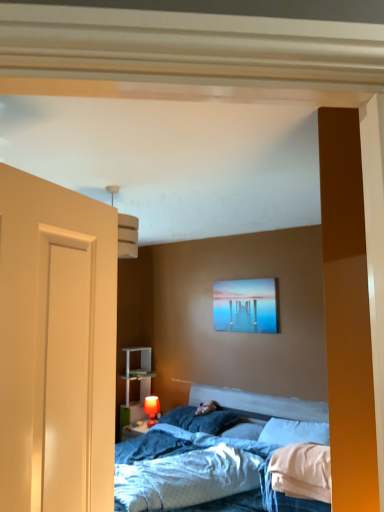
What is the approximate width of white soft pillow at center, which is counted as the 3th pillow, starting from the left?

The width of white soft pillow at center, which is counted as the 3th pillow, starting from the left, is 14.53 inches.

How much space does white soft pillow at center, which is counted as the second pillow, starting from the left, occupy vertically?

4.08 inches.

The height and width of the screenshot is (512, 384). Identify the location of blue soft pillow at center, the 1th pillow from the left. (200, 420).

What do you see at coordinates (245, 305) in the screenshot? This screenshot has height=512, width=384. I see `matte acrylic painting at upper center` at bounding box center [245, 305].

What do you see at coordinates (151, 409) in the screenshot? Image resolution: width=384 pixels, height=512 pixels. I see `matte red table lamp at lower center` at bounding box center [151, 409].

Where is `blue textured sheet at center`? blue textured sheet at center is located at coordinates (179, 446).

Is blue textured sheet at center next to white soft pillow at center, the 2th pillow from the right?

No, blue textured sheet at center is not touching white soft pillow at center, the 2th pillow from the right.

At what (x,y) coordinates should I click in order to perform the action: click on the 2nd pillow located beneath the blue textured sheet at center (from a real-world perspective). Please return your answer as a coordinate pair (x, y). Looking at the image, I should click on (244, 431).

Can you tell me how much blue textured sheet at center and white soft pillow at center, which is counted as the second pillow, starting from the left, differ in facing direction?

The angle between the facing direction of blue textured sheet at center and the facing direction of white soft pillow at center, which is counted as the second pillow, starting from the left, is 29.6 degrees.

In order to click on pillow that is the 1st one when counting forward from the white plastic shelf at lower left in this screenshot , I will do `click(200, 420)`.

Is point (226, 422) farther from camera compared to point (127, 414)?

No, (226, 422) is closer to viewer.

From the image's perspective, who appears lower, blue soft pillow at center, the 1th pillow from the left, or white plastic shelf at lower left?

white plastic shelf at lower left, from the image's perspective.

Considering the positions of objects blue soft pillow at center, which is counted as the third pillow, starting from the right, and white plastic shelf at lower left in the image provided, who is more to the right, blue soft pillow at center, which is counted as the third pillow, starting from the right, or white plastic shelf at lower left?

blue soft pillow at center, which is counted as the third pillow, starting from the right.

From a real-world perspective, which object stands above the other?

white soft pillow at center, the 1th pillow from the right, is physically above.

Looking at this image, from the image's perspective, who appears lower, matte red table lamp at lower center or white soft pillow at center, which is counted as the 3th pillow, starting from the left?

matte red table lamp at lower center appears lower in the image.

In the scene shown: Considering the relative sizes of matte red table lamp at lower center and white soft pillow at center, the 1th pillow from the right, in the image provided, is matte red table lamp at lower center thinner than white soft pillow at center, the 1th pillow from the right,?

Yes, matte red table lamp at lower center is thinner than white soft pillow at center, the 1th pillow from the right.

Is matte red table lamp at lower center not inside white soft pillow at center, which is counted as the 3th pillow, starting from the left?

Absolutely, matte red table lamp at lower center is external to white soft pillow at center, which is counted as the 3th pillow, starting from the left.

From the image's perspective, which one is positioned lower, white soft pillow at center, the 2th pillow from the right, or white plastic shelf at lower left?

white plastic shelf at lower left.

Considering the relative positions of white soft pillow at center, the 2th pillow from the right, and white plastic shelf at lower left in the image provided, is white soft pillow at center, the 2th pillow from the right, behind white plastic shelf at lower left?

No.

Which is correct: white soft pillow at center, which is counted as the second pillow, starting from the left, is inside white plastic shelf at lower left, or outside of it?

white soft pillow at center, which is counted as the second pillow, starting from the left, exists outside the volume of white plastic shelf at lower left.

Which object is positioned more to the left, white soft pillow at center, the 2th pillow from the right, or white plastic shelf at lower left?

Positioned to the left is white plastic shelf at lower left.

Is the depth of matte red table lamp at lower center greater than that of matte acrylic painting at upper center?

Yes, it is behind matte acrylic painting at upper center.

Is matte red table lamp at lower center wider or thinner than matte acrylic painting at upper center?

In the image, matte red table lamp at lower center appears to be wider than matte acrylic painting at upper center.

Does matte red table lamp at lower center have a larger size compared to matte acrylic painting at upper center?

Incorrect, matte red table lamp at lower center is not larger than matte acrylic painting at upper center.

Are matte red table lamp at lower center and white plastic shelf at lower left far apart?

No, matte red table lamp at lower center is not far from white plastic shelf at lower left.

Where is `dresser lying behind the matte red table lamp at lower center`? dresser lying behind the matte red table lamp at lower center is located at coordinates (140, 386).

What's the angular difference between matte red table lamp at lower center and white plastic shelf at lower left's facing directions?

The angular difference between matte red table lamp at lower center and white plastic shelf at lower left is 0.822 degrees.

Considering their positions, is matte red table lamp at lower center located in front of or behind white plastic shelf at lower left?

In the image, matte red table lamp at lower center appears in front of white plastic shelf at lower left.

Between white soft pillow at center, which is counted as the 3th pillow, starting from the left, and matte acrylic painting at upper center, which one has larger width?

white soft pillow at center, which is counted as the 3th pillow, starting from the left, is wider.

Is white soft pillow at center, the 1th pillow from the right, next to matte acrylic painting at upper center?

They are not placed beside each other.

Is white soft pillow at center, the 1th pillow from the right, bigger or smaller than matte acrylic painting at upper center?

Clearly, white soft pillow at center, the 1th pillow from the right, is larger in size than matte acrylic painting at upper center.

The height and width of the screenshot is (512, 384). Find the location of `the 2nd pillow behind the blue textured sheet at center, starting your count from the anchor`. the 2nd pillow behind the blue textured sheet at center, starting your count from the anchor is located at coordinates (244, 431).

This screenshot has width=384, height=512. What are the coordinates of `dresser on the left side of blue soft pillow at center, which is counted as the third pillow, starting from the right` in the screenshot? It's located at (140, 386).

When comparing their distances from blue textured sheet at center, does white soft pillow at center, which is counted as the second pillow, starting from the left, or matte red table lamp at lower center seem further?

matte red table lamp at lower center lies further to blue textured sheet at center than the other object.

When comparing their distances from matte acrylic painting at upper center, does matte red table lamp at lower center or white soft pillow at center, the 2th pillow from the right, seem closer?

white soft pillow at center, the 2th pillow from the right, lies closer to matte acrylic painting at upper center than the other object.

When comparing their distances from matte red table lamp at lower center, does white soft pillow at center, which is counted as the 3th pillow, starting from the left, or blue soft pillow at center, which is counted as the third pillow, starting from the right, seem further?

white soft pillow at center, which is counted as the 3th pillow, starting from the left, is further to matte red table lamp at lower center.

Looking at the image, which one is located further to white soft pillow at center, the 2th pillow from the right, matte acrylic painting at upper center or blue textured sheet at center?

matte acrylic painting at upper center.

Which object lies further to the anchor point blue textured sheet at center, white soft pillow at center, the 1th pillow from the right, or white soft pillow at center, which is counted as the second pillow, starting from the left?

Among the two, white soft pillow at center, the 1th pillow from the right, is located further to blue textured sheet at center.

Estimate the real-world distances between objects in this image. Which object is further from white plastic shelf at lower left, blue soft pillow at center, which is counted as the third pillow, starting from the right, or white soft pillow at center, which is counted as the 3th pillow, starting from the left?

The object further to white plastic shelf at lower left is white soft pillow at center, which is counted as the 3th pillow, starting from the left.

From the image, which object appears to be farther from blue textured sheet at center, blue soft pillow at center, the 1th pillow from the left, or white plastic shelf at lower left?

The object further to blue textured sheet at center is white plastic shelf at lower left.

When comparing their distances from blue soft pillow at center, which is counted as the third pillow, starting from the right, does matte red table lamp at lower center or white plastic shelf at lower left seem further?

white plastic shelf at lower left lies further to blue soft pillow at center, which is counted as the third pillow, starting from the right, than the other object.

Image resolution: width=384 pixels, height=512 pixels. Identify the location of picture frame positioned between blue textured sheet at center and white plastic shelf at lower left from near to far. 245,305.

Find the location of `pillow between matte acrylic painting at upper center and blue soft pillow at center, which is counted as the third pillow, starting from the right, vertically`. pillow between matte acrylic painting at upper center and blue soft pillow at center, which is counted as the third pillow, starting from the right, vertically is located at coordinates (294, 432).

Find the location of a particular element. The width and height of the screenshot is (384, 512). table lamp between blue soft pillow at center, which is counted as the third pillow, starting from the right, and white plastic shelf at lower left in the front-back direction is located at coordinates (151, 409).

At what (x,y) coordinates should I click in order to perform the action: click on picture frame between white plastic shelf at lower left and white soft pillow at center, which is counted as the 3th pillow, starting from the left. Please return your answer as a coordinate pair (x, y). Looking at the image, I should click on (245, 305).